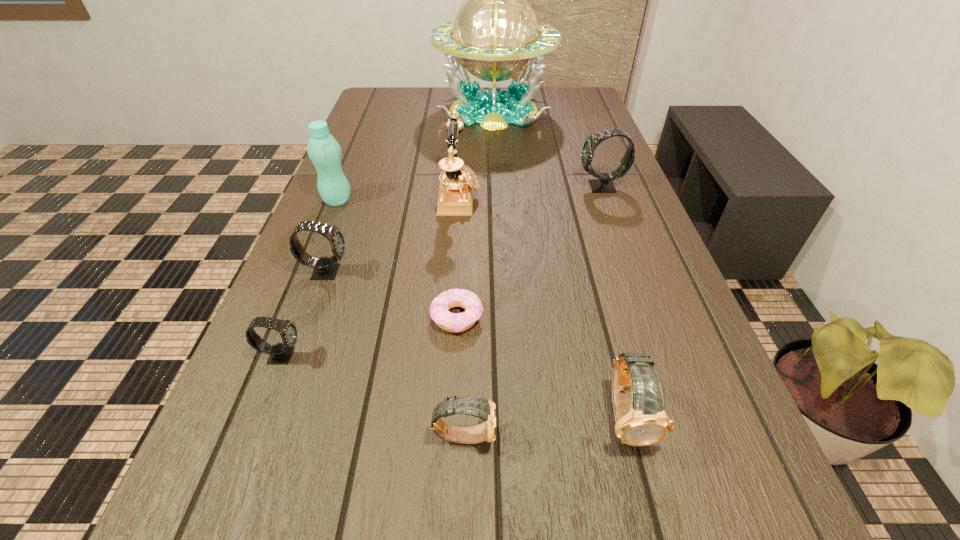
Locate an element on the screen. This screenshot has width=960, height=540. globe is located at coordinates (495, 35).

You are a GUI agent. You are given a task and a screenshot of the screen. Output one action in this format:
    pyautogui.click(x=<x>, y=<y>)
    Task: Click on the farthest object
    
    Given the screenshot: What is the action you would take?
    pyautogui.click(x=495, y=35)

Where is `bottle`? The image size is (960, 540). bottle is located at coordinates (324, 151).

In order to click on beige telephone in this screenshot , I will do `click(457, 182)`.

Locate an element on the screen. the fourth tallest object is located at coordinates (604, 184).

The height and width of the screenshot is (540, 960). Find the location of `the tallest watch`. the tallest watch is located at coordinates (604, 184).

You are a GUI agent. You are given a task and a screenshot of the screen. Output one action in this format:
    pyautogui.click(x=<x>, y=<y>)
    Task: Click on the second smallest gray watch
    The image size is (960, 540).
    Given the screenshot: What is the action you would take?
    pyautogui.click(x=325, y=268)

Identify the location of the fourth nearest watch. (325, 268).

This screenshot has width=960, height=540. Find the location of `the bigger gold watch`. the bigger gold watch is located at coordinates (640, 419).

At what (x,y) coordinates should I click in order to perform the action: click on the third watch from right to left. Please return your answer as a coordinate pair (x, y). Image resolution: width=960 pixels, height=540 pixels. Looking at the image, I should click on [x=482, y=408].